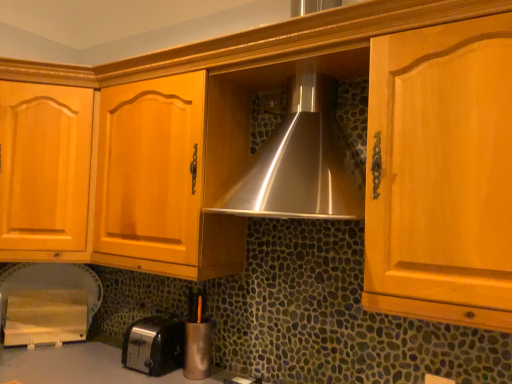
What is the approximate height of wooden cutting board at lower left, the second appliance positioned from the right?

14.37 inches.

What do you see at coordinates (154, 345) in the screenshot? The width and height of the screenshot is (512, 384). I see `satin black toaster at lower left` at bounding box center [154, 345].

Locate an element on the screen. wooden cutting board at lower left, which is counted as the second appliance, starting from the front is located at coordinates (48, 303).

From the image's perspective, is metallic silver pen holder at lower center, the first appliance viewed from the right, over satin black toaster at lower left?

Correct, metallic silver pen holder at lower center, the first appliance viewed from the right, appears higher than satin black toaster at lower left in the image.

From the image's perspective, starting from the satin black toaster at lower left, which appliance is the 1st one above? Please provide its 2D coordinates.

[(198, 346)]

Is metallic silver pen holder at lower center, which is the second appliance in back-to-front order, with satin black toaster at lower left?

No, metallic silver pen holder at lower center, which is the second appliance in back-to-front order, is not making contact with satin black toaster at lower left.

Is wooden cutting board at lower left, which is counted as the second appliance, starting from the front, shorter than metallic silver pen holder at lower center, the first appliance viewed from the right?

Yes.

Is point (64, 308) positioned in front of point (195, 339)?

That is False.

In the scene shown: Does wooden cutting board at lower left, which is counted as the second appliance, starting from the front, have a smaller size compared to metallic silver pen holder at lower center, the 1th appliance viewed from the front?

No, wooden cutting board at lower left, which is counted as the second appliance, starting from the front, is not smaller than metallic silver pen holder at lower center, the 1th appliance viewed from the front.

Can you see wooden cutting board at lower left, which is counted as the second appliance, starting from the front, touching metallic silver pen holder at lower center, the 1th appliance viewed from the front?

No, wooden cutting board at lower left, which is counted as the second appliance, starting from the front, is not beside metallic silver pen holder at lower center, the 1th appliance viewed from the front.

Which is closer to the camera, (76, 276) or (124, 349)?

Point (76, 276) is positioned farther from the camera compared to point (124, 349).

From the image's perspective, is wooden cutting board at lower left, which is counted as the 1th appliance, starting from the left, positioned above or below satin black toaster at lower left?

From the image's perspective, wooden cutting board at lower left, which is counted as the 1th appliance, starting from the left, appears above satin black toaster at lower left.

Which object is further away from the camera taking this photo, wooden cutting board at lower left, arranged as the first appliance when viewed from the back, or satin black toaster at lower left?

wooden cutting board at lower left, arranged as the first appliance when viewed from the back, is further away from the camera.

Are metallic silver pen holder at lower center, which is the second appliance in back-to-front order, and wooden cutting board at lower left, which is counted as the 1th appliance, starting from the left, making contact?

metallic silver pen holder at lower center, which is the second appliance in back-to-front order, and wooden cutting board at lower left, which is counted as the 1th appliance, starting from the left, are clearly separated.

Can you confirm if metallic silver pen holder at lower center, the first appliance viewed from the right, is shorter than wooden cutting board at lower left, which is counted as the 1th appliance, starting from the left?

No, metallic silver pen holder at lower center, the first appliance viewed from the right, is not shorter than wooden cutting board at lower left, which is counted as the 1th appliance, starting from the left.

From a real-world perspective, which object stands above the other?

metallic silver pen holder at lower center, the 1th appliance viewed from the front, is physically above.

Image resolution: width=512 pixels, height=384 pixels. Find the location of `toaster below the wooden cutting board at lower left, arranged as the first appliance when viewed from the back (from the image's perspective)`. toaster below the wooden cutting board at lower left, arranged as the first appliance when viewed from the back (from the image's perspective) is located at coordinates (154, 345).

Between satin black toaster at lower left and wooden cutting board at lower left, which is counted as the second appliance, starting from the front, which one has smaller width?

With smaller width is wooden cutting board at lower left, which is counted as the second appliance, starting from the front.

Which is less distant, (162, 349) or (18, 302)?

Point (162, 349)

Measure the distance between satin black toaster at lower left and wooden cutting board at lower left, which is counted as the second appliance, starting from the front.

They are 20.18 inches apart.

Considering the sizes of objects satin black toaster at lower left and metallic silver pen holder at lower center, the 1th appliance viewed from the front, in the image provided, who is thinner, satin black toaster at lower left or metallic silver pen holder at lower center, the 1th appliance viewed from the front,?

With smaller width is metallic silver pen holder at lower center, the 1th appliance viewed from the front.

From a real-world perspective, relative to metallic silver pen holder at lower center, which ranks as the second appliance in left-to-right order, is satin black toaster at lower left vertically above or below?

satin black toaster at lower left is situated lower than metallic silver pen holder at lower center, which ranks as the second appliance in left-to-right order, in the real world.

Which is behind, satin black toaster at lower left or metallic silver pen holder at lower center, which ranks as the second appliance in left-to-right order?

metallic silver pen holder at lower center, which ranks as the second appliance in left-to-right order, is further from the camera.

From the image's perspective, is satin black toaster at lower left located beneath metallic silver pen holder at lower center, the first appliance viewed from the right?

Yes, from the image's perspective, satin black toaster at lower left is beneath metallic silver pen holder at lower center, the first appliance viewed from the right.

The width and height of the screenshot is (512, 384). I want to click on toaster that is on the left side of metallic silver pen holder at lower center, which ranks as the second appliance in left-to-right order, so click(x=154, y=345).

The height and width of the screenshot is (384, 512). Find the location of `appliance in front of the wooden cutting board at lower left, which is counted as the 1th appliance, starting from the left`. appliance in front of the wooden cutting board at lower left, which is counted as the 1th appliance, starting from the left is located at coordinates (198, 346).

Looking at the image, which one is located closer to satin black toaster at lower left, wooden cutting board at lower left, which is counted as the second appliance, starting from the front, or metallic silver pen holder at lower center, the 1th appliance viewed from the front?

metallic silver pen holder at lower center, the 1th appliance viewed from the front.

Consider the image. From the image, which object appears to be nearer to wooden cutting board at lower left, which is counted as the 1th appliance, starting from the left, satin black toaster at lower left or metallic silver pen holder at lower center, which is the second appliance in back-to-front order?

satin black toaster at lower left is closer to wooden cutting board at lower left, which is counted as the 1th appliance, starting from the left.

From the image, which object appears to be nearer to wooden cutting board at lower left, arranged as the first appliance when viewed from the back, metallic silver pen holder at lower center, which ranks as the second appliance in left-to-right order, or satin black toaster at lower left?

The object closer to wooden cutting board at lower left, arranged as the first appliance when viewed from the back, is satin black toaster at lower left.

When comparing their distances from metallic silver pen holder at lower center, the 1th appliance viewed from the front, does wooden cutting board at lower left, arranged as the first appliance when viewed from the back, or satin black toaster at lower left seem closer?

Based on the image, satin black toaster at lower left appears to be nearer to metallic silver pen holder at lower center, the 1th appliance viewed from the front.

From the image, which object appears to be farther from metallic silver pen holder at lower center, which ranks as the second appliance in left-to-right order, satin black toaster at lower left or wooden cutting board at lower left, the second appliance positioned from the right?

wooden cutting board at lower left, the second appliance positioned from the right, is positioned further to the anchor metallic silver pen holder at lower center, which ranks as the second appliance in left-to-right order.

Considering their positions, is metallic silver pen holder at lower center, the 1th appliance viewed from the front, positioned further to satin black toaster at lower left than wooden cutting board at lower left, arranged as the first appliance when viewed from the back?

Among the two, wooden cutting board at lower left, arranged as the first appliance when viewed from the back, is located further to satin black toaster at lower left.

Where is `toaster between wooden cutting board at lower left, which is counted as the 1th appliance, starting from the left, and metallic silver pen holder at lower center, which ranks as the second appliance in left-to-right order`? toaster between wooden cutting board at lower left, which is counted as the 1th appliance, starting from the left, and metallic silver pen holder at lower center, which ranks as the second appliance in left-to-right order is located at coordinates (154, 345).